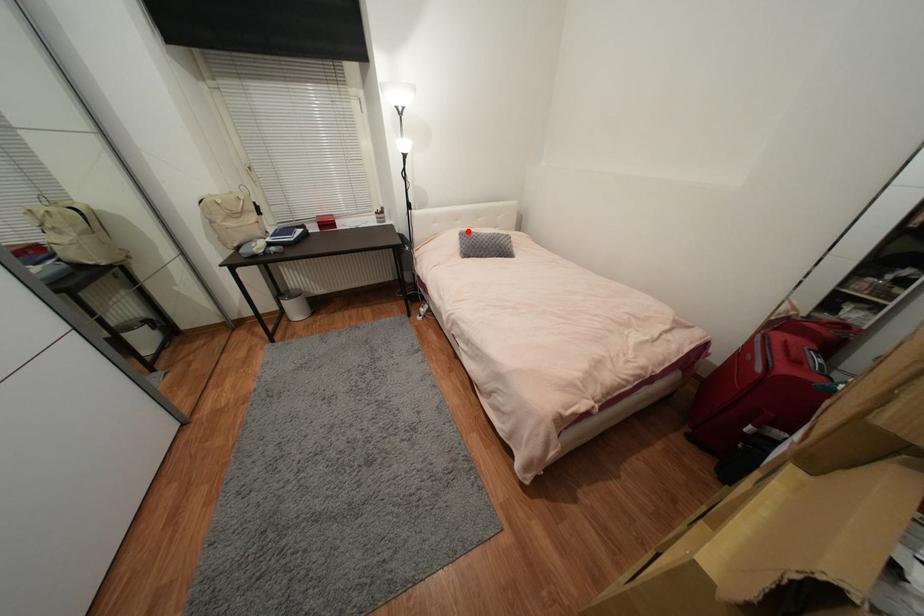
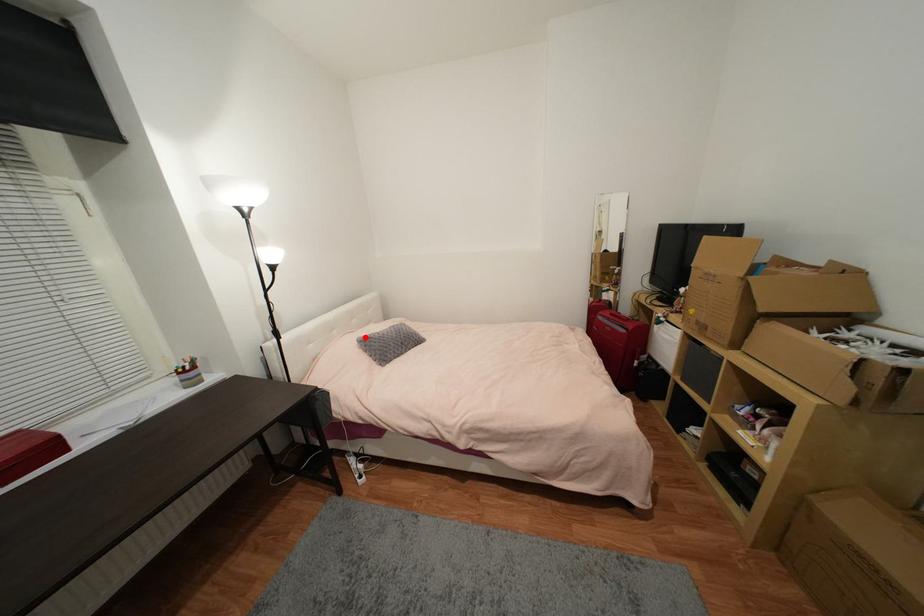
I am providing you with two images of the same scene from different viewpoints. A red point is marked on the first image and another point is marked on the second image. Do the highlighted points in image1 and image2 indicate the same real-world spot?

Yes